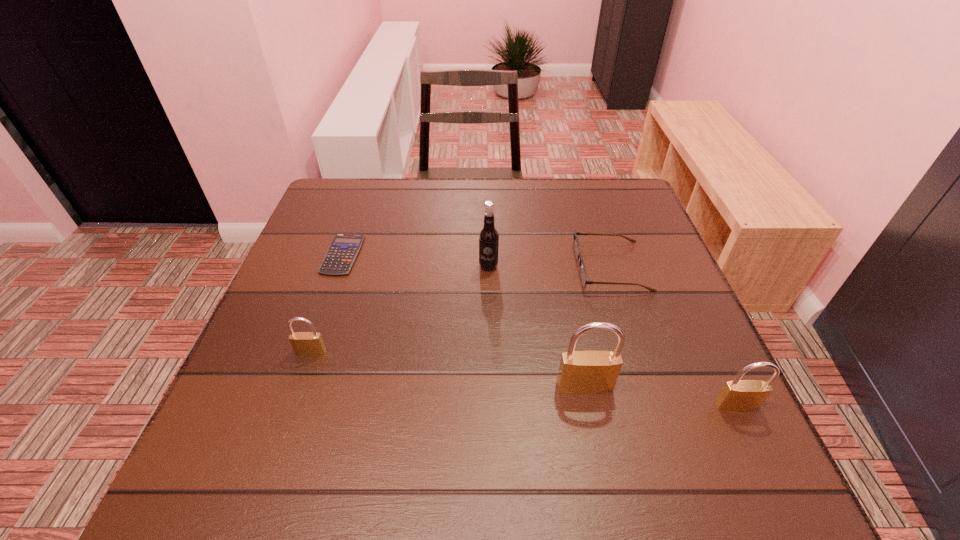
Identify the location of the shortest padlock. This screenshot has height=540, width=960. (304, 343).

Find the location of a particular element. This screenshot has height=540, width=960. the third nearest object is located at coordinates pos(304,343).

Where is `the tallest padlock`? This screenshot has width=960, height=540. the tallest padlock is located at coordinates (580, 372).

Identify the location of the second padlock from right to left. (580, 372).

Find the location of a particular element. This screenshot has width=960, height=540. the rightmost object is located at coordinates (738, 395).

Find the location of a particular element. the rightmost padlock is located at coordinates (738, 395).

Identify the location of the shortest object. The width and height of the screenshot is (960, 540). (343, 250).

I want to click on root beer, so click(488, 237).

You are a GUI agent. You are given a task and a screenshot of the screen. Output one action in this format:
    pyautogui.click(x=<x>, y=<y>)
    Task: Click on the fifth tallest object
    The image size is (960, 540).
    Given the screenshot: What is the action you would take?
    583,274

Where is `vacant position located 0.080m on the front-facing side of the farthest padlock`? This screenshot has height=540, width=960. vacant position located 0.080m on the front-facing side of the farthest padlock is located at coordinates (298, 391).